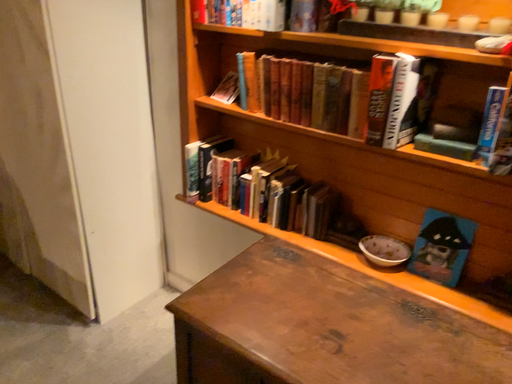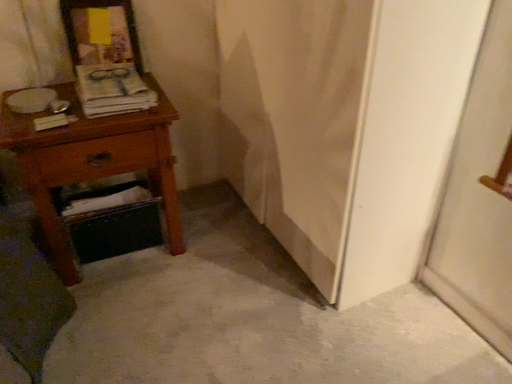
Question: How did the camera likely rotate when shooting the video?

Choices:
 (A) rotated downward
 (B) rotated upward

Answer: (A)